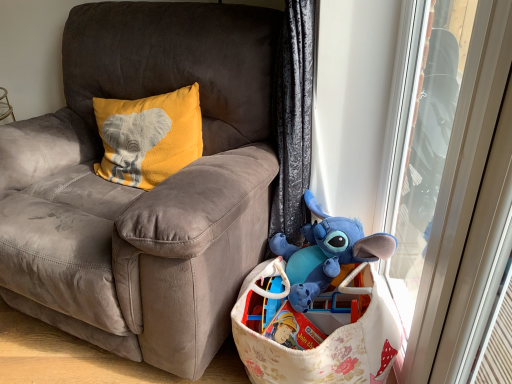
Question: Does blue plush toy at lower right have a lesser height compared to transparent plastic screen door at right?

Choices:
 (A) yes
 (B) no

Answer: (A)

Question: Is blue plush toy at lower right outside of transparent plastic screen door at right?

Choices:
 (A) yes
 (B) no

Answer: (A)

Question: Are blue plush toy at lower right and transparent plastic screen door at right making contact?

Choices:
 (A) no
 (B) yes

Answer: (A)

Question: Is blue plush toy at lower right thinner than transparent plastic screen door at right?

Choices:
 (A) no
 (B) yes

Answer: (A)

Question: From a real-world perspective, is blue plush toy at lower right under transparent plastic screen door at right?

Choices:
 (A) yes
 (B) no

Answer: (A)

Question: Can you confirm if blue plush toy at lower right is positioned to the right of transparent plastic screen door at right?

Choices:
 (A) yes
 (B) no

Answer: (B)

Question: From the image's perspective, is transparent plastic screen door at right located beneath blue plush toy at lower right?

Choices:
 (A) no
 (B) yes

Answer: (A)

Question: Is transparent plastic screen door at right facing away from blue plush toy at lower right?

Choices:
 (A) no
 (B) yes

Answer: (B)

Question: Is transparent plastic screen door at right to the right of blue plush toy at lower right from the viewer's perspective?

Choices:
 (A) yes
 (B) no

Answer: (A)

Question: Does transparent plastic screen door at right have a lesser width compared to blue plush toy at lower right?

Choices:
 (A) yes
 (B) no

Answer: (A)

Question: From the image's perspective, is transparent plastic screen door at right above blue plush toy at lower right?

Choices:
 (A) no
 (B) yes

Answer: (B)

Question: Can you confirm if transparent plastic screen door at right is taller than blue plush toy at lower right?

Choices:
 (A) yes
 (B) no

Answer: (A)

Question: Is transparent plastic screen door at right shorter than suede gray chair at center?

Choices:
 (A) yes
 (B) no

Answer: (B)